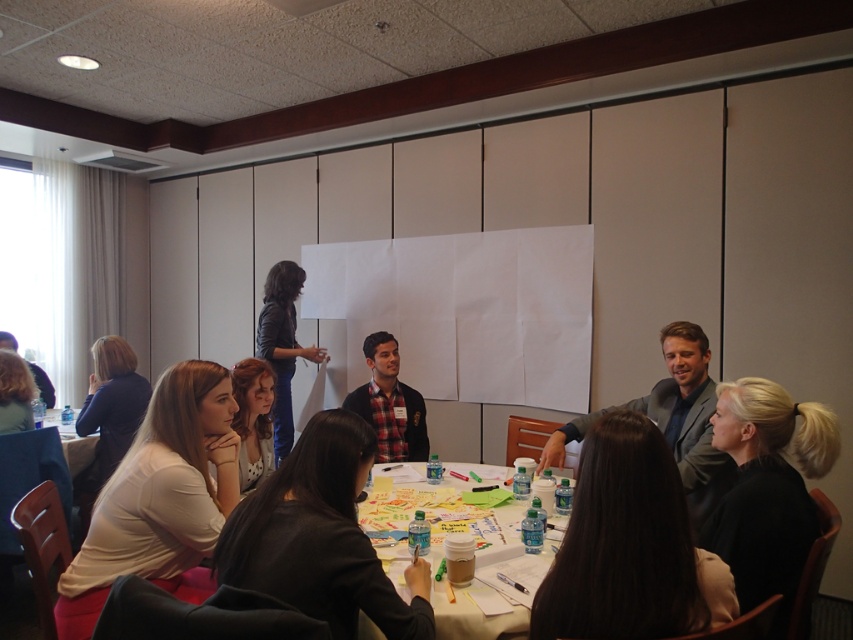
You are a photographer taking a picture of the dark gray shirt at lower left and the clear plastic water bottle at lower left. Which object should you focus on first if you want to capture both in the same frame without moving the camera?

The dark gray shirt at lower left is smaller than the clear plastic water bottle at lower left. Since the shirt is smaller, you should focus on the shirt first to ensure it is in sharp focus before adjusting for the larger bottle.

You are sitting at the round table in the conference room and notice two points marked on the table. The first point is at coordinates point (537,612) and the second point is at point (799,444). If you were to look directly at the second point, would the first point be visible in your field of view?

Yes, the first point (537,612) is in front of the second point (799,444), so when looking directly at the second point, the first point would still be visible in your field of view because it is positioned closer to you relative to the second point.

You are a photographer positioned at the entrance of the conference room. You want to take a photo of the plaid fabric shirt at center without the dark gray shirt at lower left blocking it. What should you do?

To avoid the dark gray shirt at lower left blocking the plaid fabric shirt at center, you should adjust your angle or position so that the dark gray shirt at lower left is no longer in front of the plaid fabric shirt at center, since the dark gray shirt at lower left is currently in front of it.